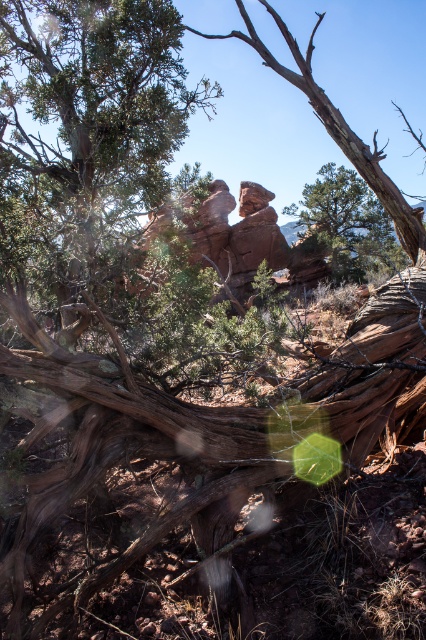
Question: Is rustic stone rock formation at center above green matte tree at center?

Choices:
 (A) no
 (B) yes

Answer: (A)

Question: Which object appears farthest from the camera in this image?

Choices:
 (A) green matte tree at center
 (B) rustic stone rock formation at center

Answer: (A)

Question: Can you confirm if rustic stone rock formation at center is positioned to the right of green matte tree at center?

Choices:
 (A) no
 (B) yes

Answer: (A)

Question: Which of the following is the closest to the observer?

Choices:
 (A) rustic stone rock formation at center
 (B) green matte tree at center

Answer: (A)

Question: Considering the relative positions of rustic stone rock formation at center and green matte tree at center in the image provided, where is rustic stone rock formation at center located with respect to green matte tree at center?

Choices:
 (A) left
 (B) right

Answer: (A)